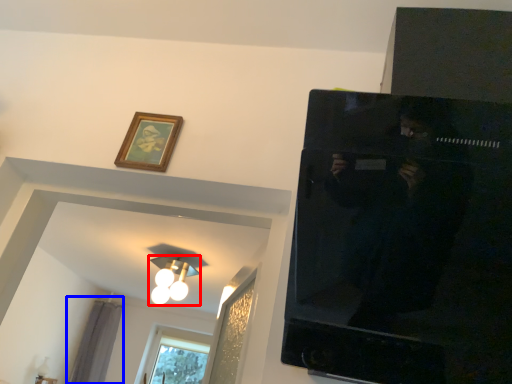
Question: Among these objects, which one is farthest to the camera, light fixture (highlighted by a red box) or curtain (highlighted by a blue box)?

Choices:
 (A) light fixture
 (B) curtain

Answer: (B)